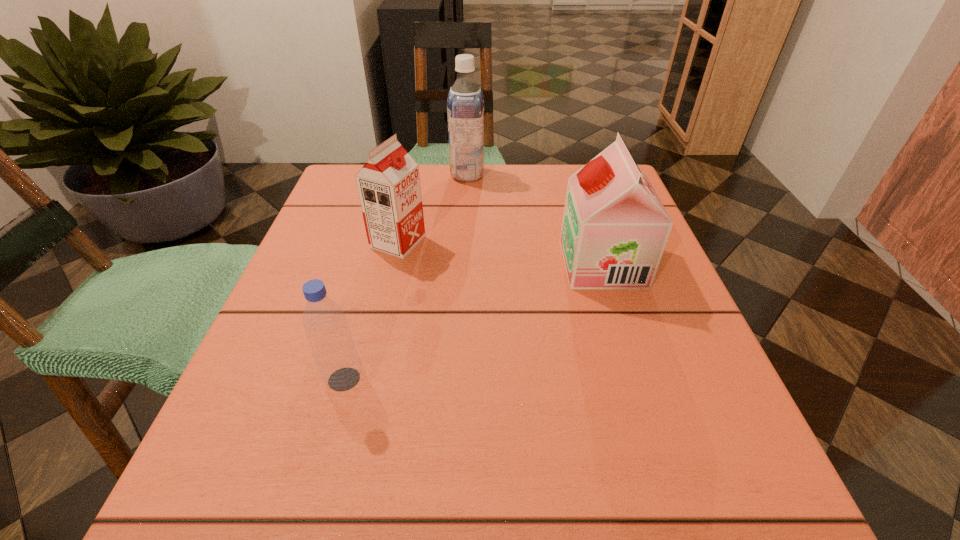
You are a GUI agent. You are given a task and a screenshot of the screen. Output one action in this format:
    pyautogui.click(x=<x>, y=<y>)
    Task: Click on the tallest soya milk
    The width and height of the screenshot is (960, 540).
    Given the screenshot: What is the action you would take?
    pyautogui.click(x=465, y=103)

Image resolution: width=960 pixels, height=540 pixels. Find the location of `the farthest object`. the farthest object is located at coordinates (465, 103).

Locate an element on the screen. The width and height of the screenshot is (960, 540). the rightmost soya milk is located at coordinates (615, 228).

Locate an element on the screen. Image resolution: width=960 pixels, height=540 pixels. the leftmost soya milk is located at coordinates (388, 185).

Identify the location of the nearest object. (335, 354).

You are a GUI agent. You are given a task and a screenshot of the screen. Output one action in this format:
    pyautogui.click(x=<x>, y=<y>)
    Task: Click on the free region located on the label of the tallest soya milk
    
    Given the screenshot: What is the action you would take?
    pyautogui.click(x=591, y=174)

Identify the location of vacant space situated with the cap open on the rightmost soya milk. Image resolution: width=960 pixels, height=540 pixels. (528, 264).

The image size is (960, 540). I want to click on vacant space located with the cap open on the rightmost soya milk, so click(367, 264).

The height and width of the screenshot is (540, 960). What are the coordinates of `free space located 0.380m with the cap open on the rightmost soya milk` in the screenshot? It's located at (367, 264).

The width and height of the screenshot is (960, 540). Find the location of `free space located 0.350m on the front of the leftmost soya milk`. free space located 0.350m on the front of the leftmost soya milk is located at coordinates (357, 424).